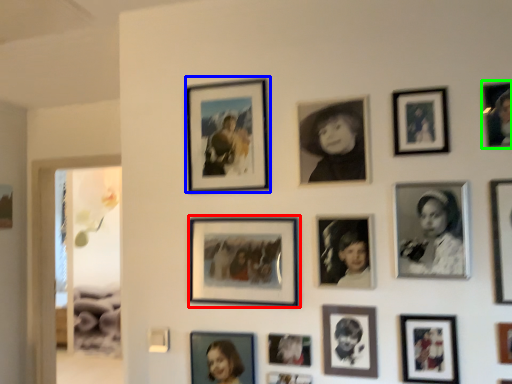
Question: Estimate the real-world distances between objects in this image. Which object is closer to picture frame (highlighted by a red box), picture frame (highlighted by a blue box) or picture frame (highlighted by a green box)?

Choices:
 (A) picture frame
 (B) picture frame

Answer: (A)